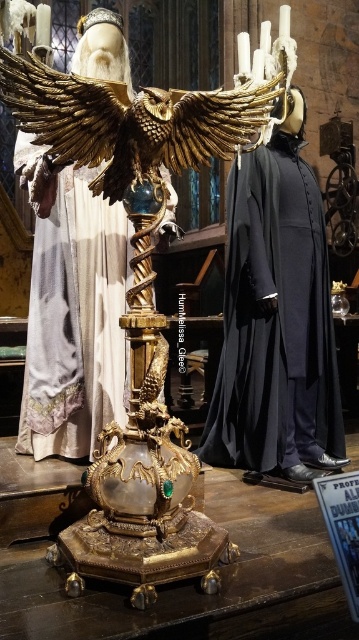
You are a costume designer trying to measure the distance between the dark blue velvet robe at center and the gold textured eagle at center. Can you fit a 36 inch long measuring tape between them without bending it?

The distance between the dark blue velvet robe at center and the gold textured eagle at center is 35.89 inches, so yes, the 36 inch measuring tape can fit between them without bending since the distance is slightly less than the tape length.

You are standing in the grand room and see a point marked at coordinates (274, 321). Which object is this point located on?

The point at coordinates (274, 321) is located on the dark blue velvet robe at center.

You are an assistant organizing a museum exhibit. You need to place a sign indicating the correct order of the dark blue velvet robe at center and the gold textured eagle at center from left to right. What should the order be?

The gold textured eagle at center is on the left, and the dark blue velvet robe at center is on the right, so the sign should list them in the order gold textured eagle at center followed by dark blue velvet robe at center.